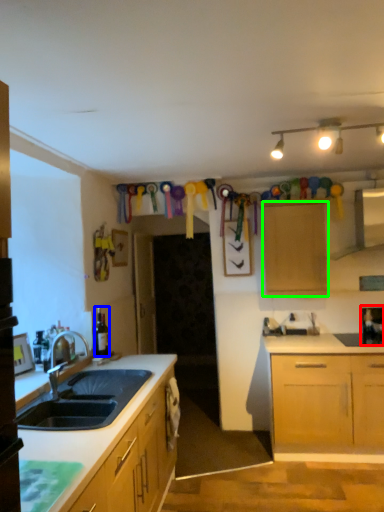
Question: Based on their relative distances, which object is nearer to appliance (highlighted by a red box)? Choose from bottle (highlighted by a blue box) and cabinetry (highlighted by a green box).

Choices:
 (A) bottle
 (B) cabinetry

Answer: (B)